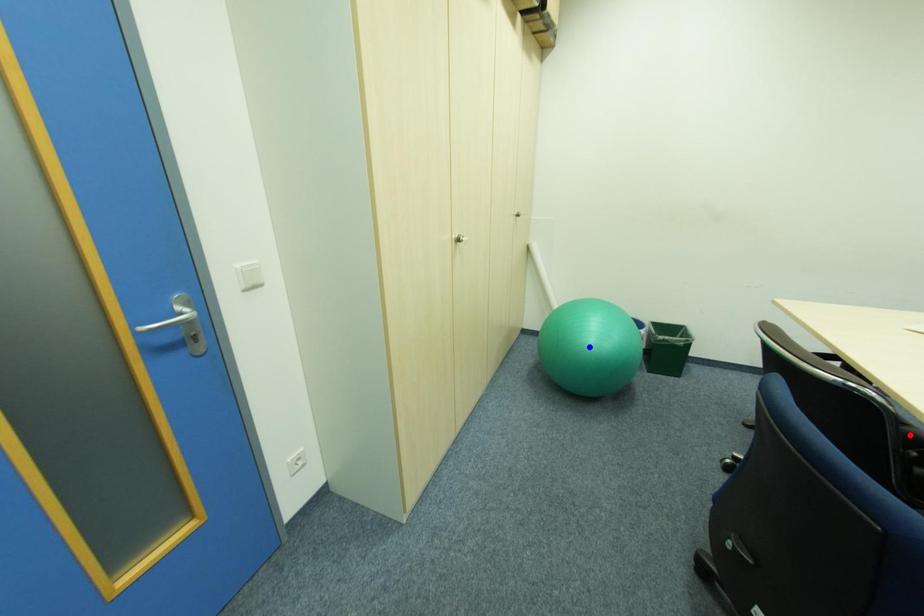
Question: In the image, two points are highlighted. Which point is nearer to the camera? Reply with the corresponding letter.

Choices:
 (A) blue point
 (B) red point

Answer: (B)